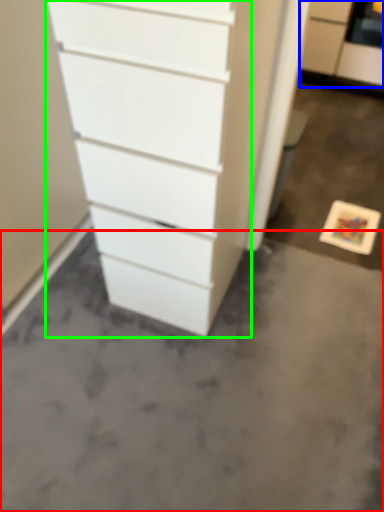
Question: Which is farther away from concrete (highlighted by a red box)? filing cabinet (highlighted by a blue box) or chest of drawers (highlighted by a green box)?

Choices:
 (A) filing cabinet
 (B) chest of drawers

Answer: (A)